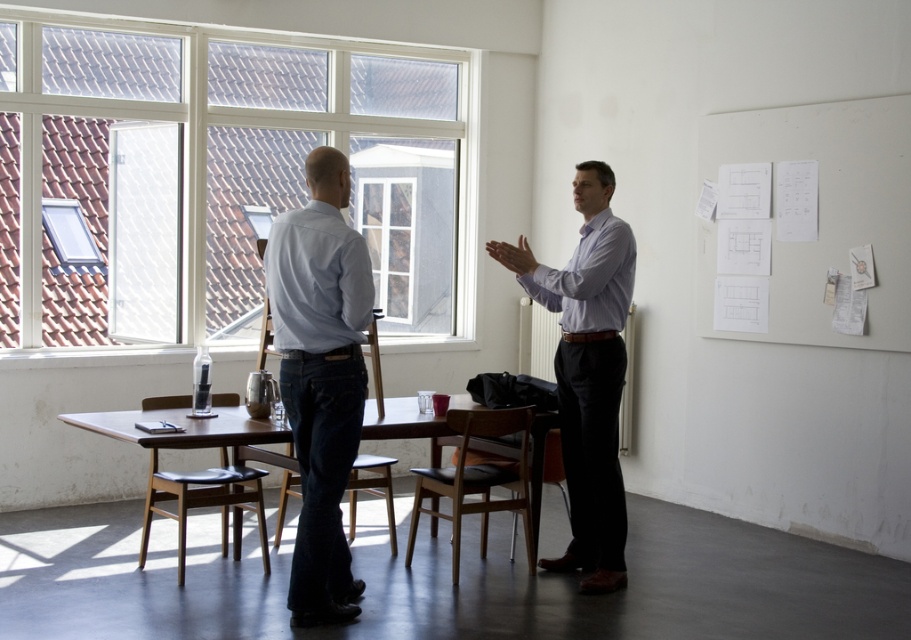
You are a delivery person who needs to place a package on the light brown wooden table at center. You are currently standing next to the white paper at upper right. Can you reach the table without moving past the table?

The distance between the white paper at upper right and the light brown wooden table at center is 4.33 meters. Since you are standing next to the white paper at upper right, you would need to move towards the table to place the package, as the table is 4.33 meters away from your current position.

From the picture: You are a person who is 1.8 meters tall standing in the room. You see the denim jeans at center and the light brown wooden table at center. Which object is taller than you?

The denim jeans at center is much taller than the light brown wooden table at center, but since you are 1.8 meters tall, neither of them is taller than you.

You are standing in the room and want to pick up the denim jeans at center and place it on the light brown wooden table at center. Can you reach the table without moving your position?

The denim jeans at center is closer to the viewer than the light brown wooden table at center, so you can reach the table without moving your position because the jeans are in front of it.